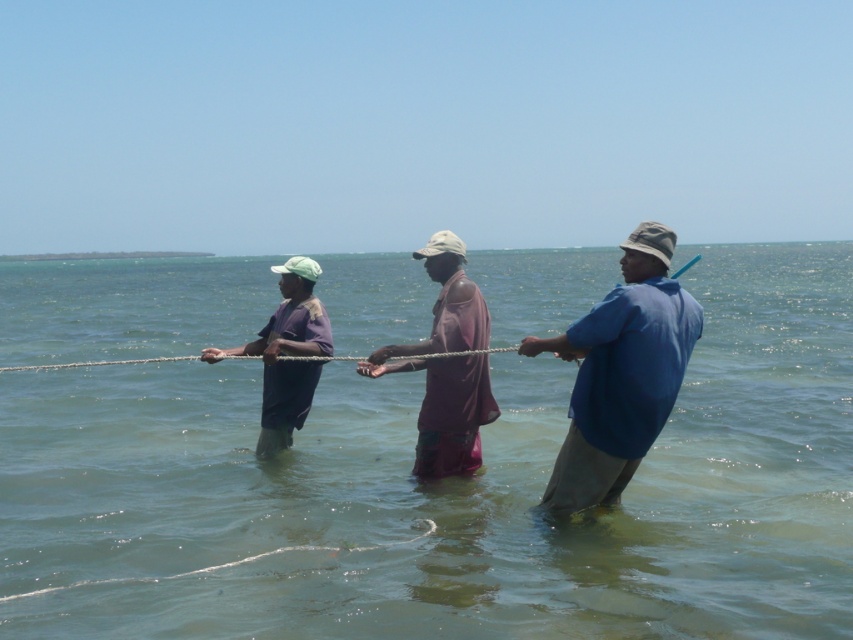
Question: Among these objects, which one is nearest to the camera?

Choices:
 (A) blue cotton shirt at right
 (B) blue fabric shirt at center

Answer: (A)

Question: Which of the following is the farthest from the observer?

Choices:
 (A) (469, 298)
 (B) (190, 552)
 (C) (668, 252)
 (D) (289, 282)

Answer: (D)

Question: Estimate the real-world distances between objects in this image. Which object is closer to the clear water at center?

Choices:
 (A) purple fabric shirt at center
 (B) blue cotton shirt at right

Answer: (A)

Question: Can you confirm if blue cotton shirt at right is positioned to the right of purple fabric shirt at center?

Choices:
 (A) yes
 (B) no

Answer: (A)

Question: Is clear water at center below purple cotton shirt at left?

Choices:
 (A) yes
 (B) no

Answer: (B)

Question: Does purple fabric shirt at center appear under purple cotton shirt at left?

Choices:
 (A) no
 (B) yes

Answer: (A)